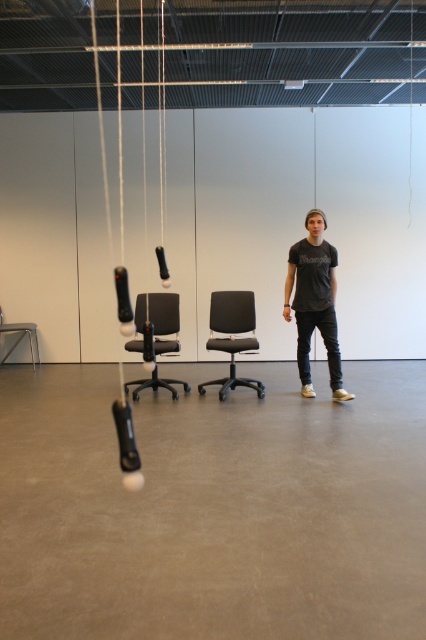
Is the position of black matte chair at center less distant than that of metallic gray chair at lower left?

Yes.

Is the position of black matte chair at center more distant than that of metallic gray chair at lower left?

No, it is in front of metallic gray chair at lower left.

I want to click on black matte chair at center, so click(x=233, y=336).

Which is more to the left, dark gray t-shirt at center or matte black office chair at center?

matte black office chair at center is more to the left.

Does dark gray t-shirt at center lie behind matte black office chair at center?

No, dark gray t-shirt at center is closer to the viewer.

The height and width of the screenshot is (640, 426). I want to click on dark gray t-shirt at center, so click(314, 301).

What are the coordinates of `dark gray t-shirt at center` in the screenshot? It's located at (314, 301).

Is dark gray t-shirt at center above black matte chair at center?

Correct, dark gray t-shirt at center is located above black matte chair at center.

Which is in front, point (307, 364) or point (221, 394)?

Point (221, 394)

Who is more forward, (x=328, y=324) or (x=236, y=301)?

Point (x=328, y=324)

At what (x,y) coordinates should I click in order to perform the action: click on dark gray t-shirt at center. Please return your answer as a coordinate pair (x, y). Image resolution: width=426 pixels, height=640 pixels. Looking at the image, I should click on (314, 301).